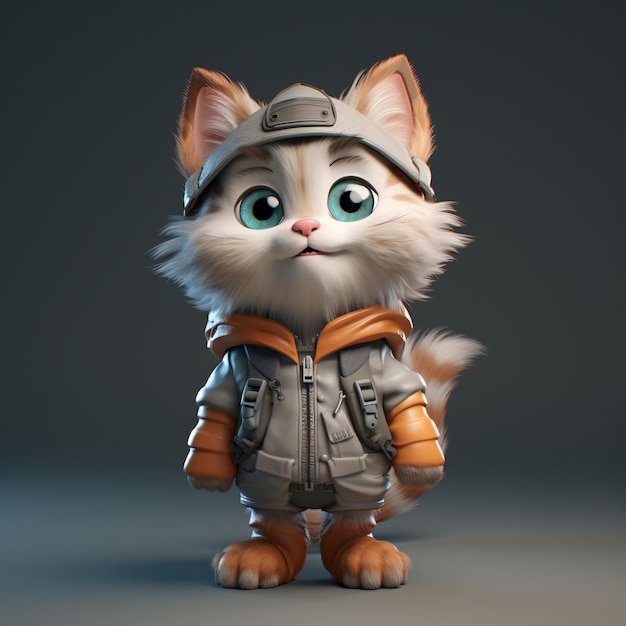
Where is `hood`? Image resolution: width=626 pixels, height=626 pixels. hood is located at coordinates (402, 319).